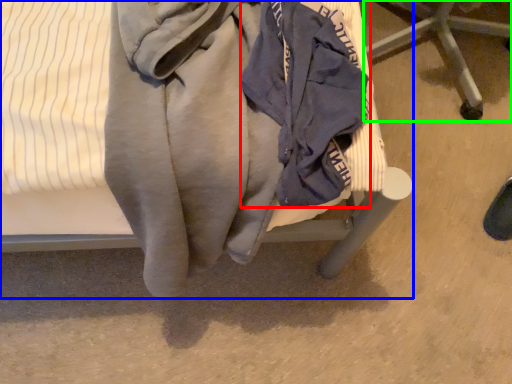
Question: Estimate the real-world distances between objects in this image. Which object is farther from garment (highlighted by a red box), furniture (highlighted by a blue box) or furniture (highlighted by a green box)?

Choices:
 (A) furniture
 (B) furniture

Answer: (B)